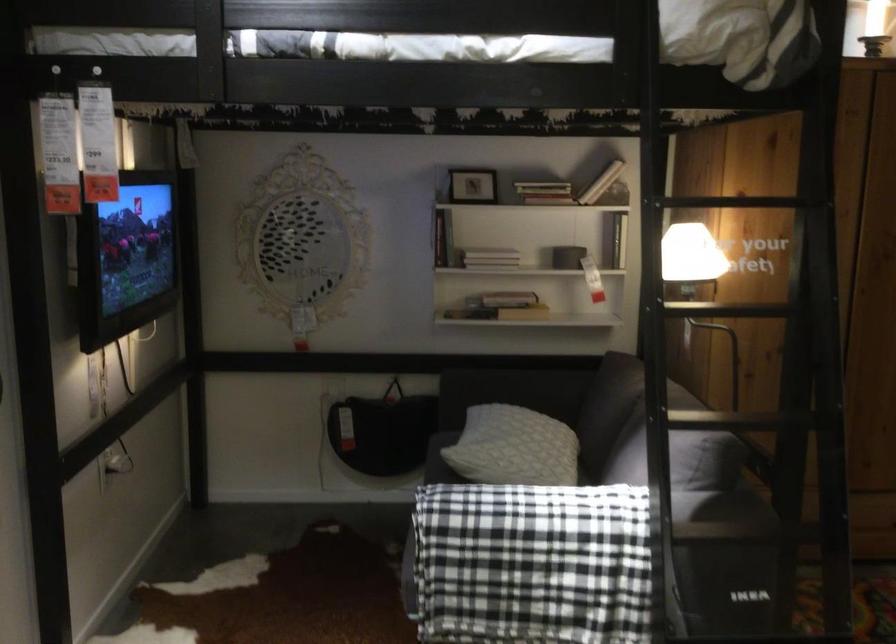
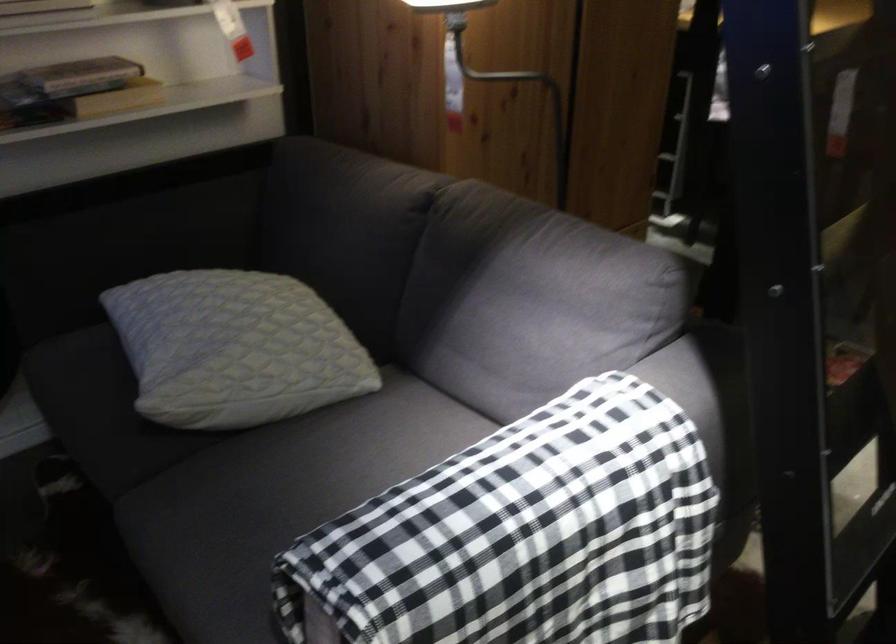
Find the pixel in the second image that matches pixel 673 516 in the first image.

(690, 395)